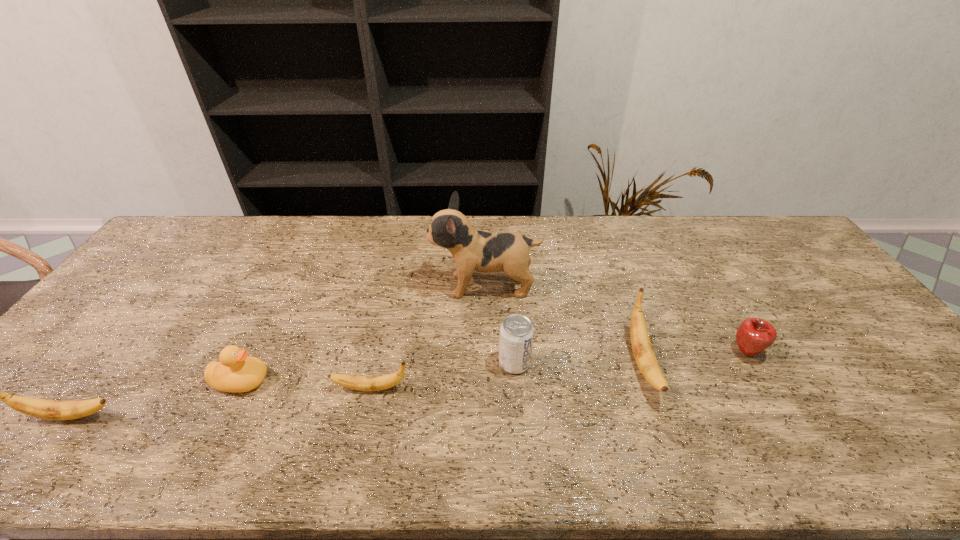
What are the coordinates of `vacant space located 0.270m on the peel of the leftmost banana from the top` in the screenshot? It's located at (236, 416).

Identify the location of vacant space located on the peel of the third object from left to right from the top. (300, 388).

In order to click on vacant space located on the peel of the third object from left to right from the top in this screenshot , I will do `click(258, 388)`.

The width and height of the screenshot is (960, 540). I want to click on free location located 0.150m on the peel of the third object from left to right from the top, so click(x=271, y=388).

Locate an element on the screen. vacant space located 0.120m on the front of the soda can is located at coordinates (518, 419).

Image resolution: width=960 pixels, height=540 pixels. Identify the location of free space located 0.120m at the face of the tallest object. (392, 286).

This screenshot has height=540, width=960. Identify the location of vacant space situated 0.070m at the face of the tallest object. (408, 286).

Locate an element on the screen. Image resolution: width=960 pixels, height=540 pixels. vacant space located 0.130m at the face of the tallest object is located at coordinates pyautogui.click(x=389, y=286).

Where is `blank space located 0.360m on the face of the second object from left to right`? blank space located 0.360m on the face of the second object from left to right is located at coordinates (414, 381).

I want to click on free region located 0.250m on the left of the apple, so click(x=636, y=352).